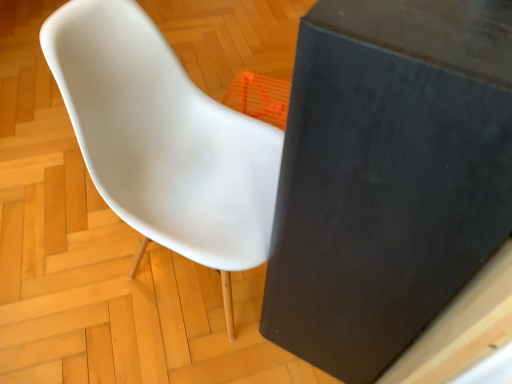
What do you see at coordinates (163, 140) in the screenshot? The image size is (512, 384). I see `white matte chair at center` at bounding box center [163, 140].

Locate an element on the screen. Image resolution: width=512 pixels, height=384 pixels. white matte chair at center is located at coordinates (163, 140).

The image size is (512, 384). Find the location of `white matte chair at center`. white matte chair at center is located at coordinates (163, 140).